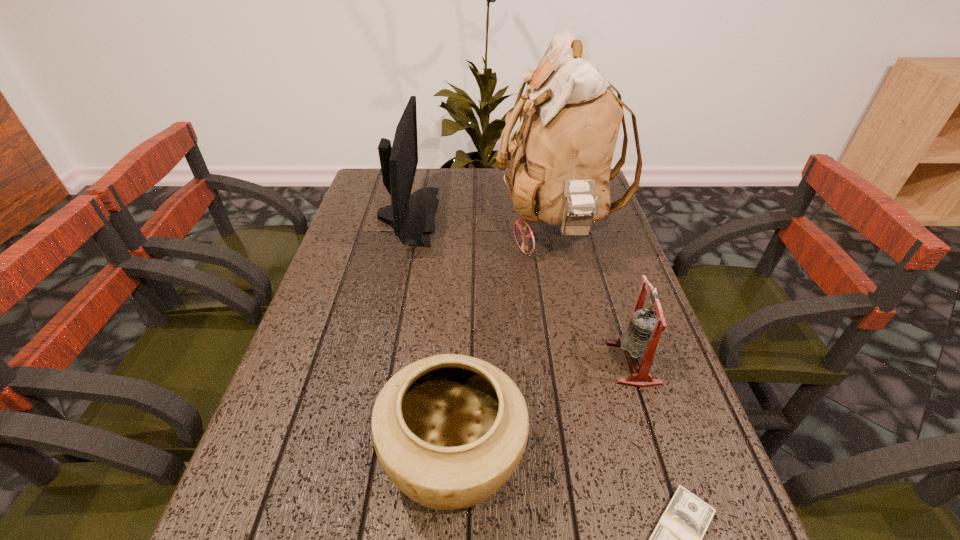
Identify the location of backpack. (560, 157).

Identify the location of monitor. The width and height of the screenshot is (960, 540). (411, 215).

This screenshot has height=540, width=960. In order to click on the third shortest object in this screenshot , I will do `click(641, 339)`.

You are a GUI agent. You are given a task and a screenshot of the screen. Output one action in this format:
    pyautogui.click(x=<x>, y=<y>)
    Task: Click on the bell
    
    Given the screenshot: What is the action you would take?
    pyautogui.click(x=641, y=339)

The height and width of the screenshot is (540, 960). I want to click on pottery, so click(x=449, y=430).

The height and width of the screenshot is (540, 960). I want to click on vacant space situated 0.090m on the front-facing side of the tallest object, so (464, 225).

At what (x,y) coordinates should I click in order to perform the action: click on vacant space located on the front-facing side of the tallest object. Please return your answer as a coordinate pair (x, y). Image resolution: width=960 pixels, height=540 pixels. Looking at the image, I should click on (443, 225).

Locate an element on the screen. vacant space located 0.250m on the front-facing side of the tallest object is located at coordinates pos(408,225).

Find the location of a particular element. The height and width of the screenshot is (540, 960). vacant region located on the screen side of the fourth shortest object is located at coordinates (554, 215).

Locate an element on the screen. Image resolution: width=960 pixels, height=540 pixels. vacant position located on the back of the third nearest object is located at coordinates (595, 247).